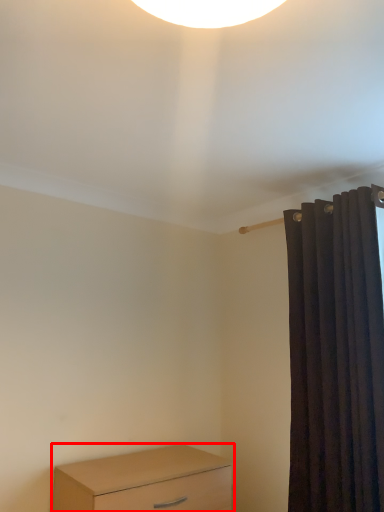
Question: From the image, what is the correct spatial relationship of chest of drawers (annotated by the red box) in relation to curtain?

Choices:
 (A) right
 (B) left

Answer: (B)